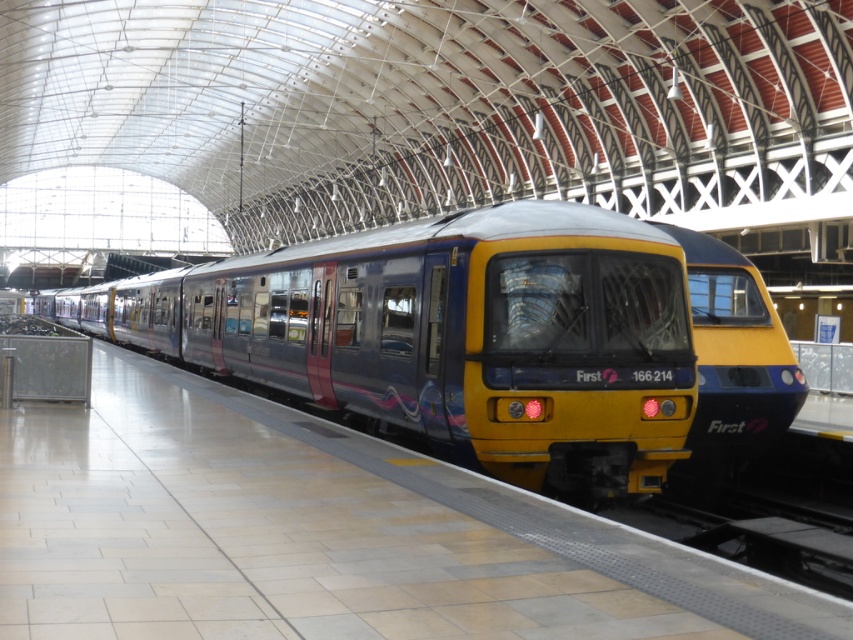
Does point (433, 300) come behind point (782, 404)?

No, (433, 300) is in front of (782, 404).

Who is positioned more to the right, metallic blue train at center or yellow glossy train at center?

From the viewer's perspective, yellow glossy train at center appears more on the right side.

The image size is (853, 640). Find the location of `metallic blue train at center`. metallic blue train at center is located at coordinates (450, 336).